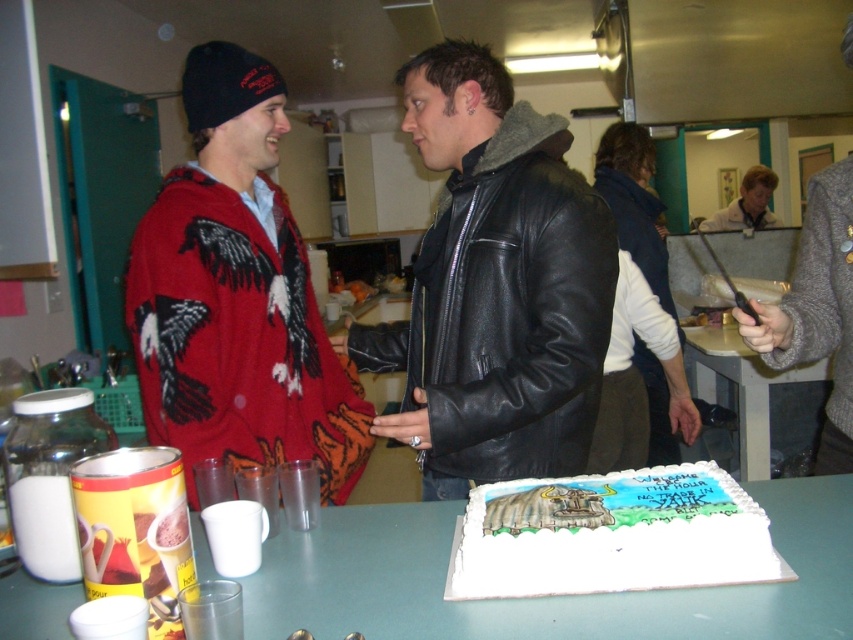
Question: Which object is the closest to the white fondant cake at center?

Choices:
 (A) light brown leather jacket at upper right
 (B) gray sweater at right

Answer: (B)

Question: Which point is closer to the camera?

Choices:
 (A) white plastic table at center
 (B) knitted wool sweater with eagle design at left
 (C) light brown leather jacket at upper right

Answer: (A)

Question: Is white fondant cake at center positioned behind gray sweater at right?

Choices:
 (A) yes
 (B) no

Answer: (B)

Question: Observing the image, what is the correct spatial positioning of knitted wool sweater with eagle design at left in reference to green plastic table at center?

Choices:
 (A) left
 (B) right

Answer: (A)

Question: Which of the following is the closest to the observer?

Choices:
 (A) light brown leather jacket at upper right
 (B) gray sweater at right

Answer: (B)

Question: Is knitted wool sweater with eagle design at left thinner than white fondant cake at center?

Choices:
 (A) yes
 (B) no

Answer: (B)